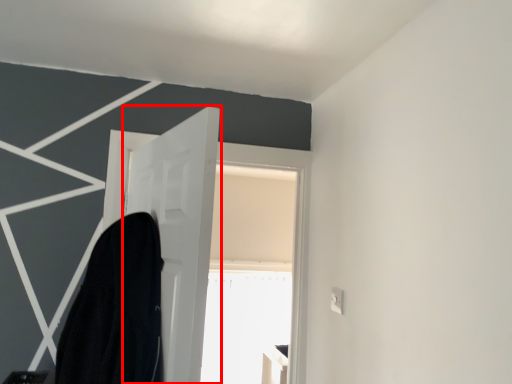
Question: Where is door (annotated by the red box) located in relation to robe in the image?

Choices:
 (A) right
 (B) left

Answer: (A)